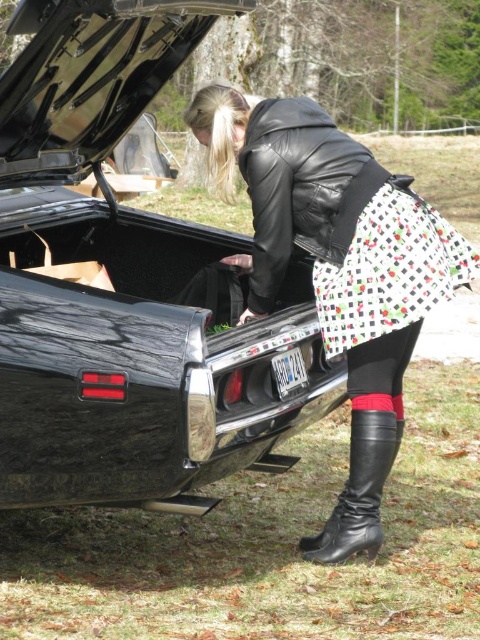
Which of these two, glossy black car at center or printed cotton skirt at center, stands shorter?

Standing shorter between the two is printed cotton skirt at center.

Which is behind, point (167, 42) or point (425, 301)?

Point (167, 42)

Does point (39, 259) come farther from viewer compared to point (425, 241)?

That is True.

Identify the location of glossy black car at center. (128, 285).

Is printed cotton dress at center positioned before black leather boot at lower center?

Yes, printed cotton dress at center is in front of black leather boot at lower center.

Is point (334, 346) less distant than point (358, 474)?

Yes.

Is point (395, 291) farther from viewer compared to point (382, 445)?

No, (395, 291) is closer to viewer.

This screenshot has height=640, width=480. I want to click on printed cotton dress at center, so click(389, 269).

What do you see at coordinates (389, 269) in the screenshot? I see `printed cotton dress at center` at bounding box center [389, 269].

Between printed cotton dress at center and printed cotton skirt at center, which one appears on the left side from the viewer's perspective?

printed cotton dress at center

Identify the location of printed cotton dress at center. This screenshot has height=640, width=480. click(x=389, y=269).

You are a GUI agent. You are given a task and a screenshot of the screen. Output one action in this format:
    pyautogui.click(x=<x>, y=<y>)
    Task: Click on the printed cotton dress at center
    
    Given the screenshot: What is the action you would take?
    pyautogui.click(x=389, y=269)